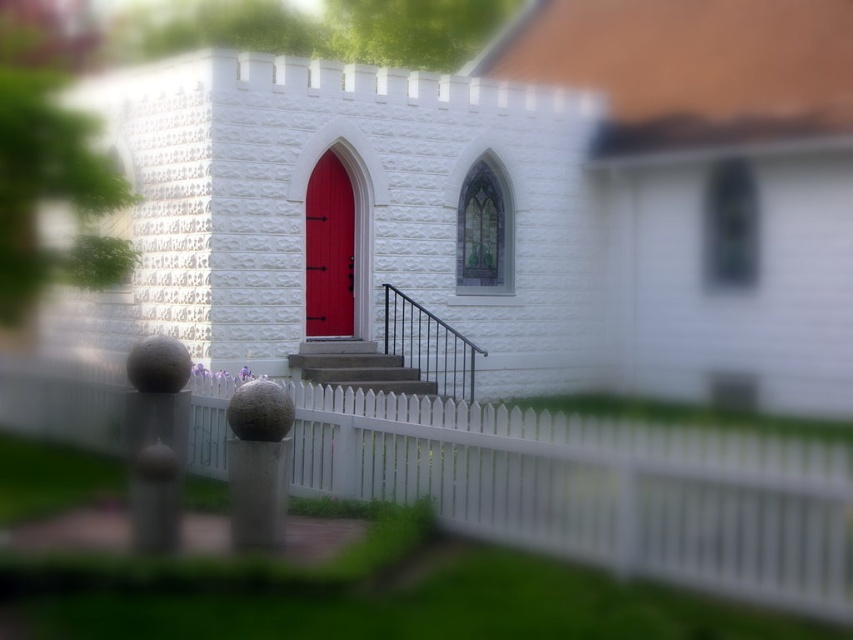
You are standing at the bottom of the smooth concrete stairs at center leading to the white stone church at center. If you look straight ahead, which object will be higher in your field of view?

The white stone church at center is above the smooth concrete stairs at center, so it will be higher in your field of view.

You are standing at the entrance of the white brick building and want to walk towards the white picket fence at center. Which direction should you move relative to the smooth concrete stairs at center?

You should move to the right of the smooth concrete stairs at center to reach the white picket fence at center since the white picket fence at center is located to the right of the smooth concrete stairs at center.

You are standing in front of the building and want to see over the white picket fence at center to look at the smooth concrete stairs at center. Can you see the top of the stairs from your current position?

The white picket fence at center is much taller than the smooth concrete stairs at center, so you cannot see the top of the stairs from your current position.